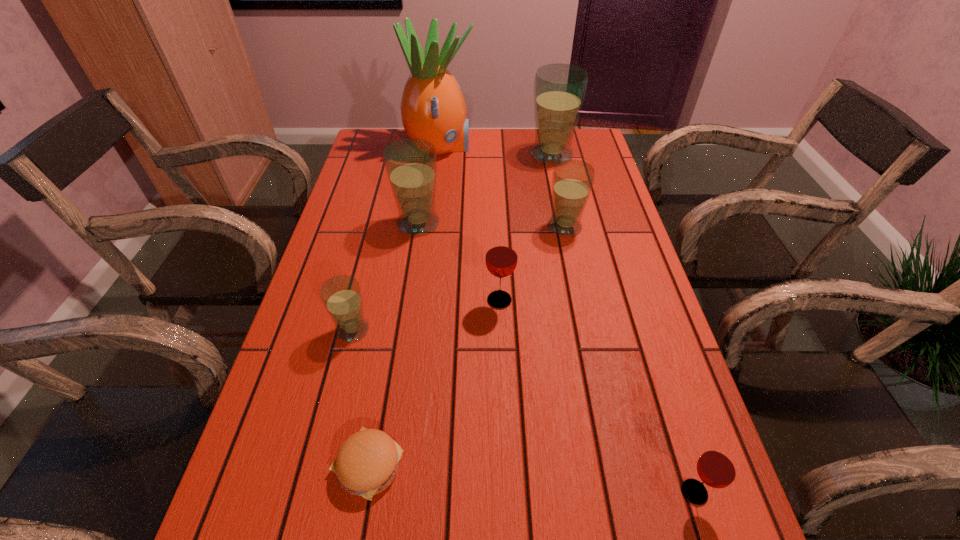
Find the location of a particular element. The height and width of the screenshot is (540, 960). free point at the right edge is located at coordinates (585, 221).

Locate an element on the screen. The width and height of the screenshot is (960, 540). vacant space at the far left corner of the desktop is located at coordinates (372, 156).

At what (x,y) coordinates should I click in order to perform the action: click on vacant space at the far right corner of the desktop. Please return your answer as a coordinate pair (x, y). The width and height of the screenshot is (960, 540). Looking at the image, I should click on (587, 133).

Identify the location of free space between the third biggest blue glass and the third glass from left to right. This screenshot has height=540, width=960. (532, 264).

Find the location of `vacant point located between the fifth shortest glass and the leftmost blue glass`. vacant point located between the fifth shortest glass and the leftmost blue glass is located at coordinates (386, 276).

You are a GUI agent. You are given a task and a screenshot of the screen. Output one action in this format:
    pyautogui.click(x=<x>, y=<y>)
    Task: Click on the empty space that is in between the orange pineapple and the nearer red glass
    
    Given the screenshot: What is the action you would take?
    pyautogui.click(x=567, y=320)

Identify the location of vacant point located between the pineapple and the second smallest blue glass. (502, 187).

This screenshot has width=960, height=540. Find the location of `empty space between the shortest object and the third biggest blue glass`. empty space between the shortest object and the third biggest blue glass is located at coordinates (467, 346).

Identify the location of free space between the fourth nearest object and the patty. (434, 383).

The height and width of the screenshot is (540, 960). What are the coordinates of `unoccupied position between the shortest object and the second blue glass from left to right` in the screenshot? It's located at (394, 344).